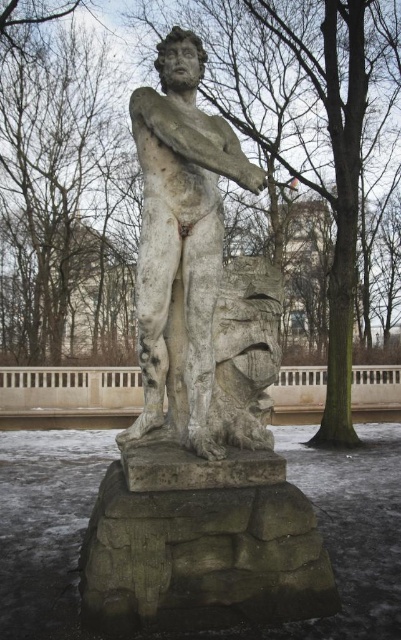
You are taking a photo of the statue and want to focus on both point [105,84] and point [170,276]. Which point is closer to the camera?

Point [170,276] is closer to the camera than point [105,84].

You are an artist planning to sketch the scene. You need to decide which object to focus on first based on their widths. Which one is wider, the bare branches at upper left or the stone statue at center?

The bare branches at upper left might be wider than stone statue at center according to the description.

You are a bird looking for a place to perch. You see the bare branches at upper left and the stone statue at center. Which one is taller?

The bare branches at upper left has a greater height compared to the stone statue at center, so the bare branches at upper left is taller.